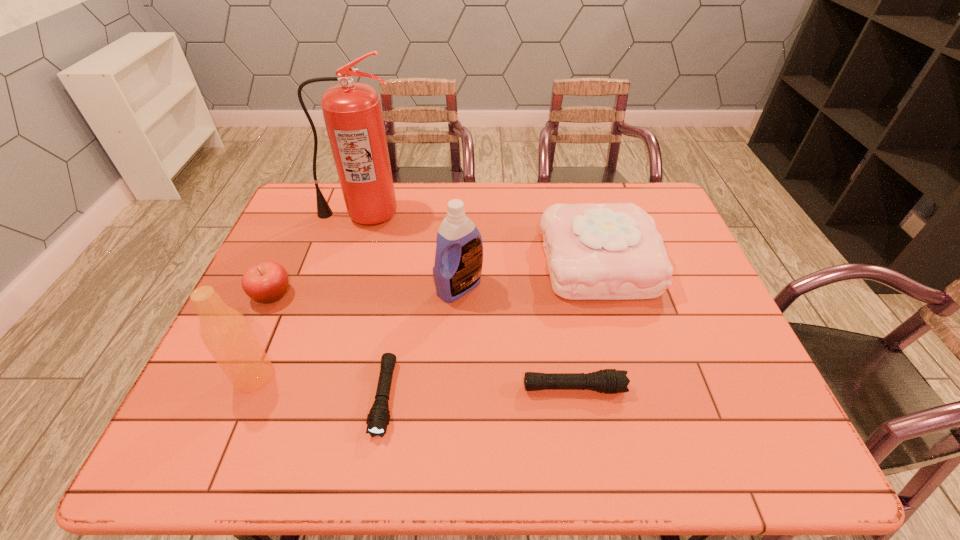
Where is `free space between the beer bottle and the fire extinguisher`? free space between the beer bottle and the fire extinguisher is located at coordinates (308, 295).

What are the coordinates of `free point between the tallest object and the second shortest object` in the screenshot? It's located at (468, 301).

Where is `free space between the fourth tallest object and the fifth object from left to right`? Image resolution: width=960 pixels, height=540 pixels. free space between the fourth tallest object and the fifth object from left to right is located at coordinates (529, 274).

Locate an element on the screen. The width and height of the screenshot is (960, 540). empty location between the beer bottle and the tallest object is located at coordinates (308, 295).

You are a GUI agent. You are given a task and a screenshot of the screen. Output one action in this format:
    pyautogui.click(x=<x>, y=<y>)
    Task: Click on the free spot between the beer bottle and the detergent
    
    Given the screenshot: What is the action you would take?
    pyautogui.click(x=357, y=332)

The image size is (960, 540). What are the coordinates of `vacant point located between the tallest object and the shorter flashlight` in the screenshot? It's located at (373, 306).

Locate an element on the screen. The height and width of the screenshot is (540, 960). empty location between the right flashlight and the shorter flashlight is located at coordinates (479, 393).

The width and height of the screenshot is (960, 540). In order to click on free point between the fifth tallest object and the shortest object in this screenshot , I will do `click(328, 346)`.

Identify the location of object that stands as the fifth closest to the fourth tallest object. (226, 333).

Locate an element on the screen. object that is the closest one to the apple is located at coordinates (226, 333).